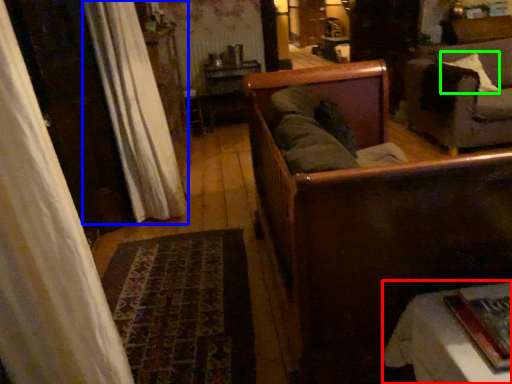
Question: Considering the real-world distances, which object is farthest from furniture (highlighted by a red box)? curtain (highlighted by a blue box) or pillow (highlighted by a green box)?

Choices:
 (A) curtain
 (B) pillow

Answer: (B)